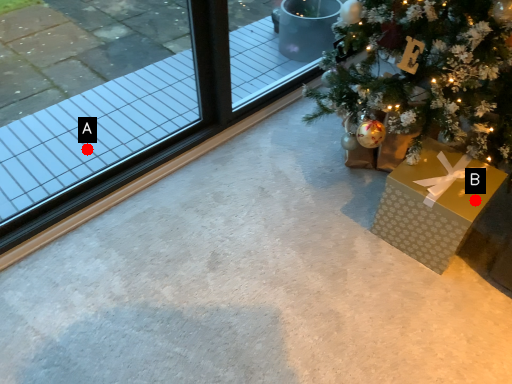
Question: Two points are circled on the image, labeled by A and B beside each circle. Which point appears closest to the camera in this image?

Choices:
 (A) A is closer
 (B) B is closer

Answer: (B)